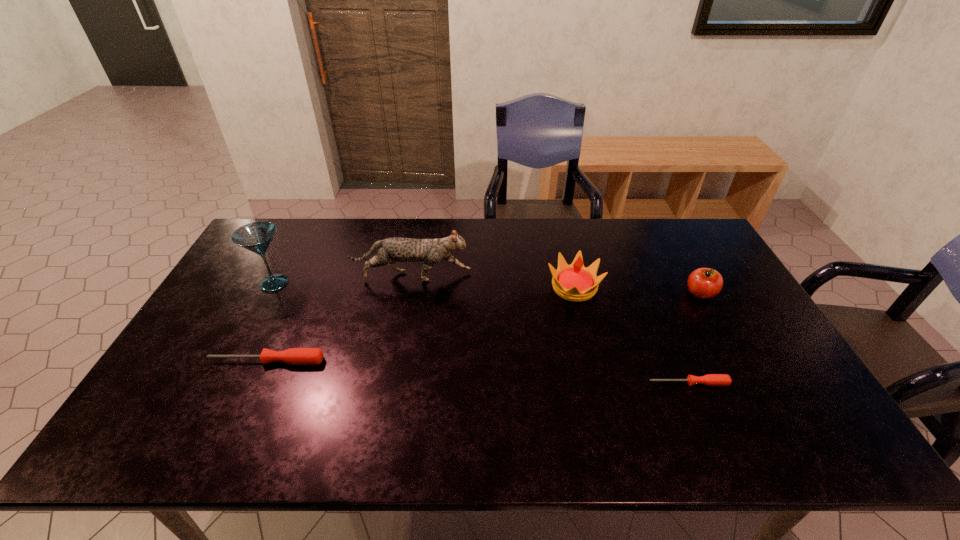
Where is `vacant position for inserting another screwdriver evenly`? This screenshot has width=960, height=540. vacant position for inserting another screwdriver evenly is located at coordinates (472, 372).